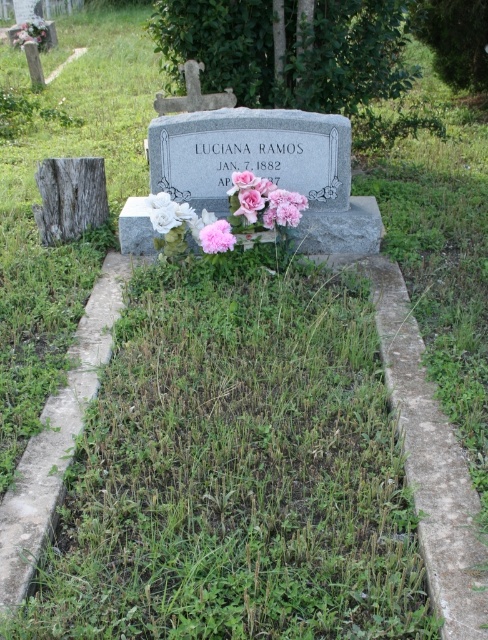
Consider the image. Is pink matte flowers at center closer to the viewer compared to pink matte flower at center?

No, it is not.

Can you confirm if pink matte flowers at center is thinner than pink matte flower at center?

No, pink matte flowers at center is not thinner than pink matte flower at center.

Identify the location of pink matte flowers at center. (263, 202).

Between white matte flower at lower left and pink matte flower at center, which one is positioned lower?

pink matte flower at center is lower down.

Who is positioned more to the right, white matte flower at lower left or pink matte flower at center?

Positioned to the right is pink matte flower at center.

Where is `white matte flower at lower left`? white matte flower at lower left is located at coordinates (168, 212).

Can you confirm if smooth gray stone at center is bigger than pink matte flowers at center?

Correct, smooth gray stone at center is larger in size than pink matte flowers at center.

Between point (82, 228) and point (288, 212), which one is positioned behind?

The point (82, 228) is behind.

Describe the element at coordinates (69, 196) in the screenshot. The width and height of the screenshot is (488, 640). I see `smooth gray stone at center` at that location.

Locate an element on the screen. The image size is (488, 640). smooth gray stone at center is located at coordinates (69, 196).